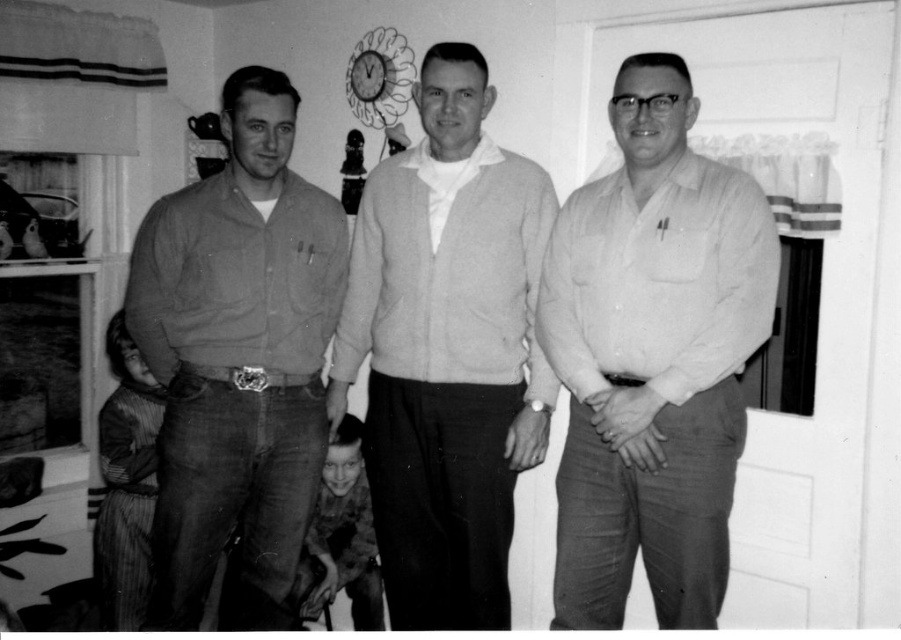
You are trying to decide which clothing item to wear for a casual event. You have the white smooth shirt at center and the light gray sweater at center. Based on their sizes in the image, which one is narrower?

The white smooth shirt at center is narrower than the light gray sweater at center because its width is less than the sweater.

You are a photographer adjusting your camera settings to focus on the light gray sweater at center and the matte brown shirt at left. Which of these two items should you focus on first to ensure proper depth of field?

The light gray sweater at center is closer to you than the matte brown shirt at left, so you should focus on the light gray sweater at center first to ensure proper depth of field.

You are a photographer trying to adjust the lighting for a group photo. You notice two men wearing the white smooth shirt at center and the light gray sweater at center. The camera you are using has a minimum focus distance of 12 inches. Can you focus on both subjects simultaneously without moving the camera?

The distance between the white smooth shirt at center and the light gray sweater at center is 12.19 inches. Since the camera requires a minimum focus distance of 12 inches, the 12.19 inches is just enough to allow both subjects to be in focus simultaneously without moving the camera.